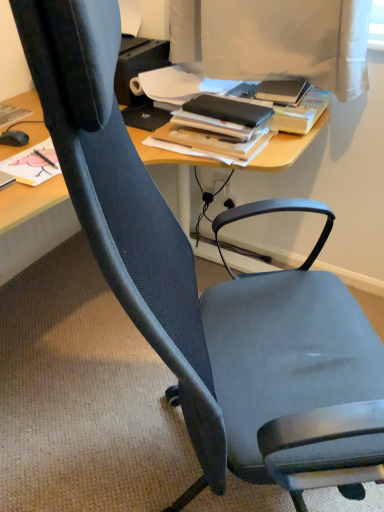
What do you see at coordinates (14, 138) in the screenshot?
I see `matte black mouse at left` at bounding box center [14, 138].

Locate an element on the screen. The width and height of the screenshot is (384, 512). matte black mouse at left is located at coordinates (14, 138).

What do you see at coordinates (220, 126) in the screenshot? Image resolution: width=384 pixels, height=512 pixels. I see `black matte book at center` at bounding box center [220, 126].

Locate an element on the screen. This screenshot has height=512, width=384. black matte book at center is located at coordinates (220, 126).

In order to click on matte black mouse at left in this screenshot , I will do `click(14, 138)`.

Is matte black mouse at left to the left of black matte book at center from the viewer's perspective?

Yes, matte black mouse at left is to the left of black matte book at center.

Between matte black mouse at left and black matte book at center, which one is positioned in front?

Positioned in front is black matte book at center.

Which is further, (11, 144) or (228, 155)?

Positioned behind is point (11, 144).

From the image's perspective, is matte black mouse at left below black matte book at center?

Indeed, from the image's perspective, matte black mouse at left is shown beneath black matte book at center.

From a real-world perspective, is matte black mouse at left physically below black matte book at center?

Yes, from a real-world perspective, matte black mouse at left is beneath black matte book at center.

Considering the sizes of objects matte black mouse at left and black matte book at center in the image provided, who is thinner, matte black mouse at left or black matte book at center?

With smaller width is matte black mouse at left.

Can you confirm if matte black mouse at left is taller than black matte book at center?

No.

Does matte black mouse at left have a larger size compared to black matte book at center?

Incorrect, matte black mouse at left is not larger than black matte book at center.

Based on the photo, is matte black mouse at left completely or partially outside of black matte book at center?

Absolutely, matte black mouse at left is external to black matte book at center.

Is matte black mouse at left far from black matte book at center?

No, matte black mouse at left is in close proximity to black matte book at center.

Is matte black mouse at left looking in the opposite direction of black matte book at center?

No, black matte book at center is not at the back of matte black mouse at left.

What's the angular difference between matte black mouse at left and black matte book at center's facing directions?

87.6 degrees separate the facing orientations of matte black mouse at left and black matte book at center.

You are a GUI agent. You are given a task and a screenshot of the screen. Output one action in this format:
    pyautogui.click(x=<x>, y=<y>)
    Task: Click on the mouse behind the black matte book at center
    The height and width of the screenshot is (512, 384).
    Given the screenshot: What is the action you would take?
    pyautogui.click(x=14, y=138)

Does black matte book at center appear on the left side of matte black mouse at left?

No.

Is black matte book at center closer to camera compared to matte black mouse at left?

Yes, the depth of black matte book at center is less than that of matte black mouse at left.

Which point is more distant from viewer, (215, 149) or (18, 130)?

The point (18, 130) is farther.

From the image's perspective, is black matte book at center located above matte black mouse at left?

Yes, from the image's perspective, black matte book at center is on top of matte black mouse at left.

From a real-world perspective, is black matte book at center below matte black mouse at left?

No.

Which object is wider, black matte book at center or matte black mouse at left?

With larger width is black matte book at center.

Consider the image. Considering the sizes of objects black matte book at center and matte black mouse at left in the image provided, who is taller, black matte book at center or matte black mouse at left?

Standing taller between the two is black matte book at center.

Considering the relative sizes of black matte book at center and matte black mouse at left in the image provided, is black matte book at center smaller than matte black mouse at left?

No.

Which is correct: black matte book at center is inside matte black mouse at left, or outside of it?

black matte book at center is not inside matte black mouse at left, it's outside.

Is black matte book at center next to matte black mouse at left and touching it?

No, black matte book at center is not with matte black mouse at left.

Is black matte book at center turned away from matte black mouse at left?

No.

How different are the orientations of black matte book at center and matte black mouse at left in degrees?

87.6 degrees separate the facing orientations of black matte book at center and matte black mouse at left.

Consider the image. Measure the distance from black matte book at center to matte black mouse at left.

They are 22.57 inches apart.

In the image, there is a black matte book at center. Identify the location of mouse below it (from the image's perspective). The width and height of the screenshot is (384, 512). (14, 138).

You are a GUI agent. You are given a task and a screenshot of the screen. Output one action in this format:
    pyautogui.click(x=<x>, y=<y>)
    Task: Click on the book above the matte black mouse at left (from a real-world perspective)
    The height and width of the screenshot is (512, 384).
    Given the screenshot: What is the action you would take?
    pyautogui.click(x=220, y=126)

Locate an element on the screen. mouse behind the black matte book at center is located at coordinates (14, 138).